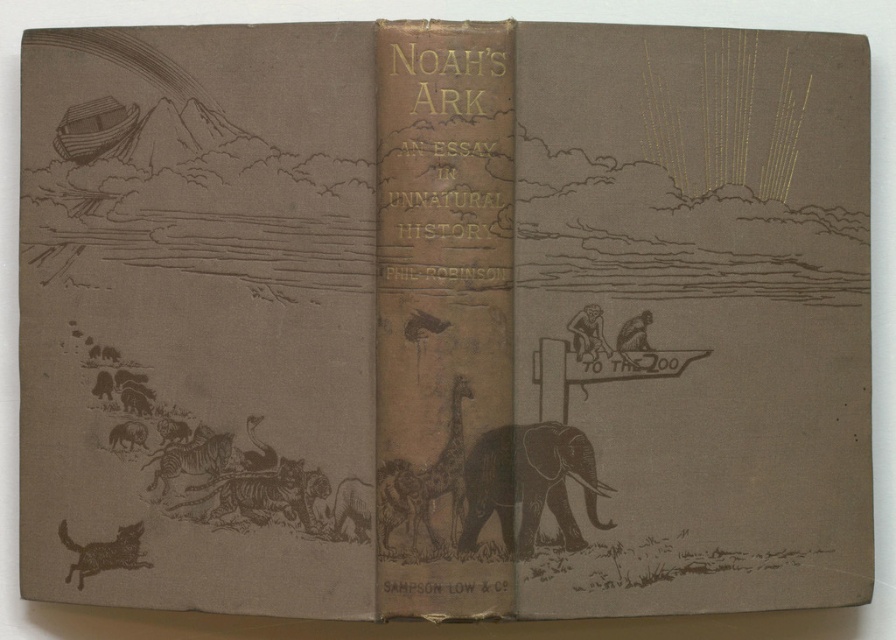
Does brown textured elephant at center appear on the left side of brown textured dog at lower left?

In fact, brown textured elephant at center is to the right of brown textured dog at lower left.

Which is behind, point (522, 476) or point (108, 557)?

The point (108, 557) is more distant.

This screenshot has width=896, height=640. Find the location of `brown textured elephant at center`. brown textured elephant at center is located at coordinates (528, 483).